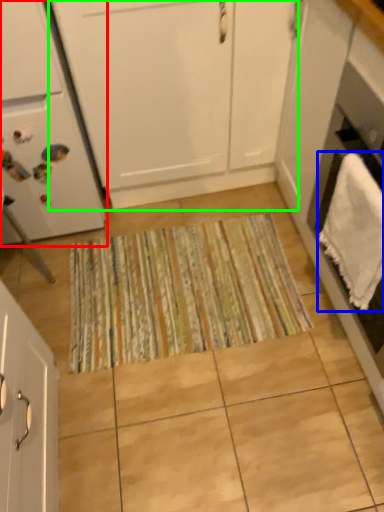
Question: Considering the real-world distances, which object is farthest from home appliance (highlighted by a red box)? bath towel (highlighted by a blue box) or cabinetry (highlighted by a green box)?

Choices:
 (A) bath towel
 (B) cabinetry

Answer: (A)